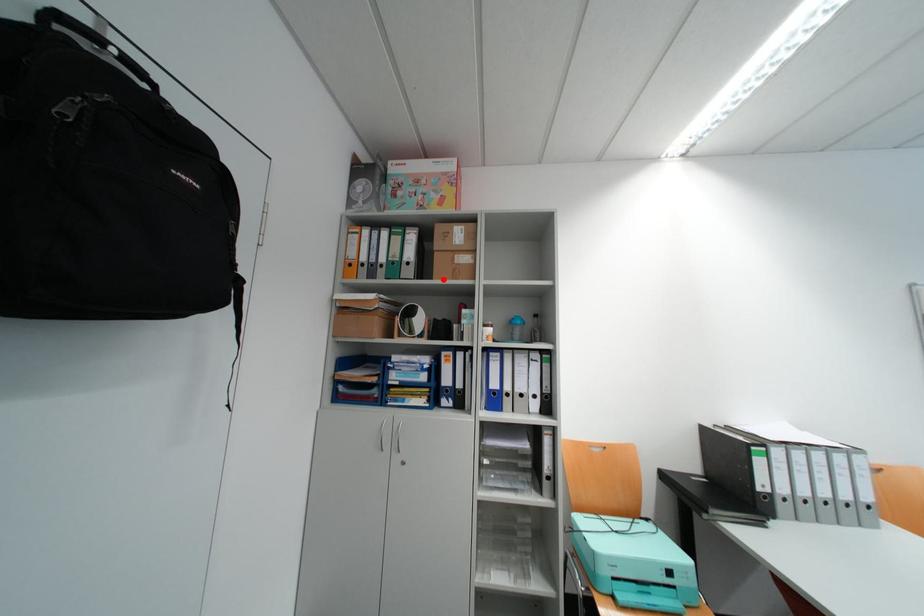
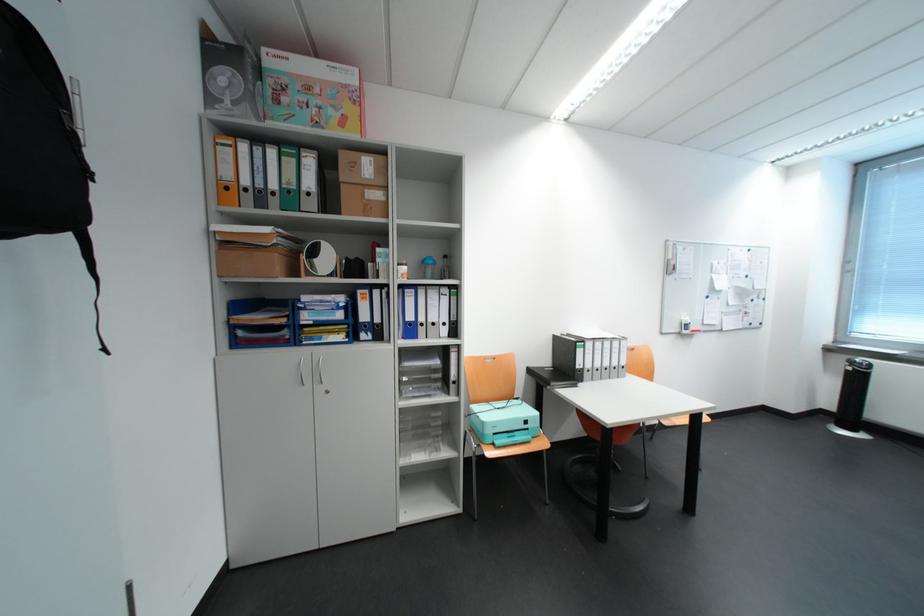
The point at the highlighted location is marked in the first image. Where is the corresponding point in the second image?

(351, 215)